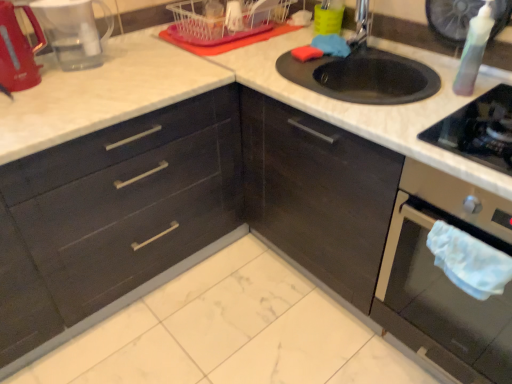
At what (x,y) coordinates should I click in order to perform the action: click on vacant space that's between transparent plastic bottle at upper right, the second appliance in the left-to-right sequence, and transparent plastic bottle at upper right. Please return your answer as a coordinate pair (x, y). The width and height of the screenshot is (512, 384). Looking at the image, I should click on (438, 76).